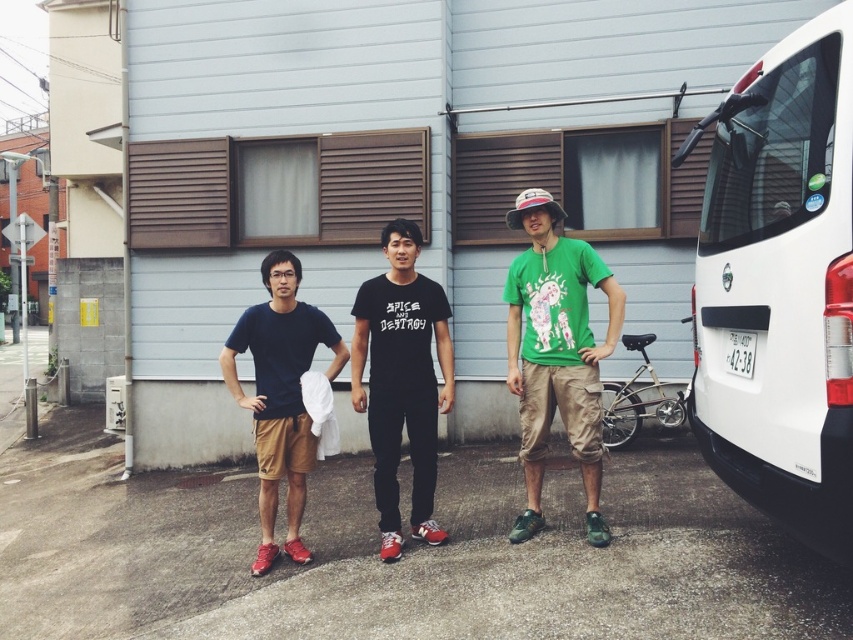
Who is lower down, green cotton t-shirt at center or black matte t-shirt at center?

black matte t-shirt at center is below.

Can you confirm if green cotton t-shirt at center is positioned to the right of black matte t-shirt at center?

Yes, green cotton t-shirt at center is to the right of black matte t-shirt at center.

I want to click on green cotton t-shirt at center, so point(556,353).

The width and height of the screenshot is (853, 640). I want to click on green cotton t-shirt at center, so click(x=556, y=353).

Does point (704, 371) come farther from viewer compared to point (564, 356)?

No.

Does white matte van at right appear on the right side of green cotton t-shirt at center?

Indeed, white matte van at right is positioned on the right side of green cotton t-shirt at center.

Is point (793, 365) positioned in front of point (517, 540)?

Yes, it is in front of point (517, 540).

Identify the location of white matte van at right. The width and height of the screenshot is (853, 640). (780, 285).

Which is above, white matte van at right or matte blue t-shirt at center?

Positioned higher is white matte van at right.

What do you see at coordinates (780, 285) in the screenshot?
I see `white matte van at right` at bounding box center [780, 285].

Which is behind, point (776, 438) or point (347, 355)?

The point (347, 355) is more distant.

Locate an element on the screen. This screenshot has height=640, width=853. white matte van at right is located at coordinates (780, 285).